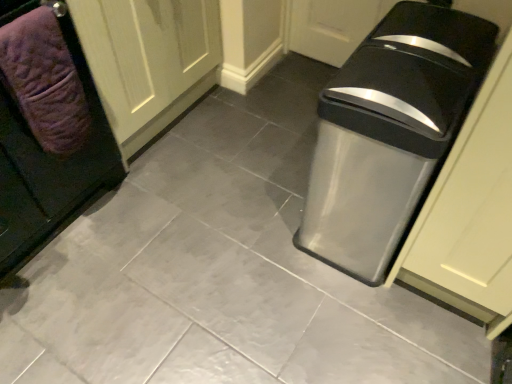
Question: Is purple quilted towel at left situated inside metallic gray trash can at right or outside?

Choices:
 (A) inside
 (B) outside

Answer: (B)

Question: From the image's perspective, is purple quilted towel at left positioned above or below metallic gray trash can at right?

Choices:
 (A) above
 (B) below

Answer: (A)

Question: Which object is the closest to the purple quilted towel at left?

Choices:
 (A) white wood door at upper left
 (B) purple textured towel at left
 (C) metallic gray trash can at right

Answer: (B)

Question: Based on their relative distances, which object is nearer to the purple quilted towel at left?

Choices:
 (A) metallic gray trash can at right
 (B) white wood door at upper left
 (C) purple textured towel at left

Answer: (C)